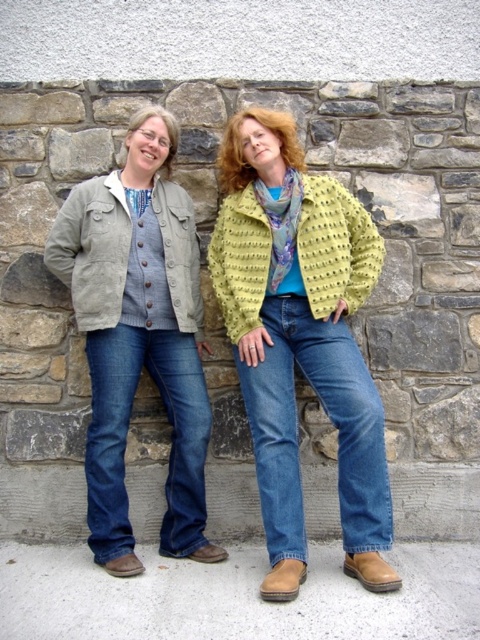
Consider the image. You are taking a photo of two people standing against a stone wall. You notice two points on the wall labeled as point [242,285] and point [282,268]. Which point is closer to the camera?

Point [242,285] is closer to the camera than point [282,268] because it is further to the camera than the other point.

You are trying to decide if the matte gray jacket at center can completely cover the multicolored silk scarf at center when placed over it. Based on their sizes, what do you think?

The matte gray jacket at center might be wider than the multicolored silk scarf at center, so there is a possibility that the jacket could cover the scarf if positioned correctly.

You are a photographer setting up a camera at position point 0.0, 0.0. You want to capture the lime textured cardigan at center in your photo. What direction should you move your camera to get the cardigan into the frame?

The lime textured cardigan at center is located at point (336, 246). Since the camera is at (0, 0), you should move the camera to the right and upwards to position (336, 246) to capture the cardigan.